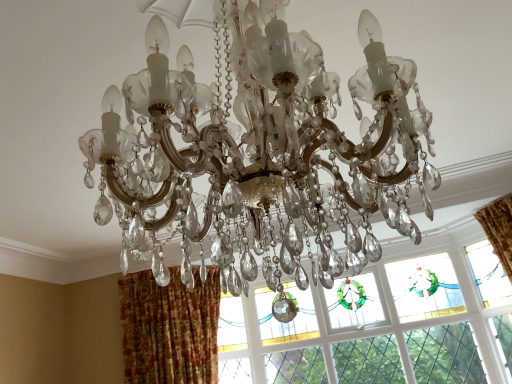
Question: Is clear crystal chandelier at center bigger than stained glass window at center?

Choices:
 (A) yes
 (B) no

Answer: (A)

Question: Is clear crystal chandelier at center at the right side of stained glass window at center?

Choices:
 (A) no
 (B) yes

Answer: (A)

Question: Is clear crystal chandelier at center wider than stained glass window at center?

Choices:
 (A) yes
 (B) no

Answer: (A)

Question: Is clear crystal chandelier at center closer to camera compared to stained glass window at center?

Choices:
 (A) yes
 (B) no

Answer: (A)

Question: Does clear crystal chandelier at center contain stained glass window at center?

Choices:
 (A) no
 (B) yes

Answer: (A)

Question: Does clear crystal chandelier at center have a smaller size compared to stained glass window at center?

Choices:
 (A) no
 (B) yes

Answer: (A)

Question: From a real-world perspective, is clear crystal chandelier at center positioned under textured orange curtain at lower left based on gravity?

Choices:
 (A) no
 (B) yes

Answer: (A)

Question: Considering the relative sizes of clear crystal chandelier at center and textured orange curtain at lower left in the image provided, is clear crystal chandelier at center wider than textured orange curtain at lower left?

Choices:
 (A) yes
 (B) no

Answer: (A)

Question: Does clear crystal chandelier at center have a lesser width compared to textured orange curtain at lower left?

Choices:
 (A) no
 (B) yes

Answer: (A)

Question: From the image's perspective, is clear crystal chandelier at center above textured orange curtain at lower left?

Choices:
 (A) yes
 (B) no

Answer: (A)

Question: Is clear crystal chandelier at center further to the viewer compared to textured orange curtain at lower left?

Choices:
 (A) no
 (B) yes

Answer: (A)

Question: From a real-world perspective, is clear crystal chandelier at center physically above textured orange curtain at lower left?

Choices:
 (A) yes
 (B) no

Answer: (A)

Question: Is textured orange curtain at lower left turned away from clear crystal chandelier at center?

Choices:
 (A) no
 (B) yes

Answer: (A)